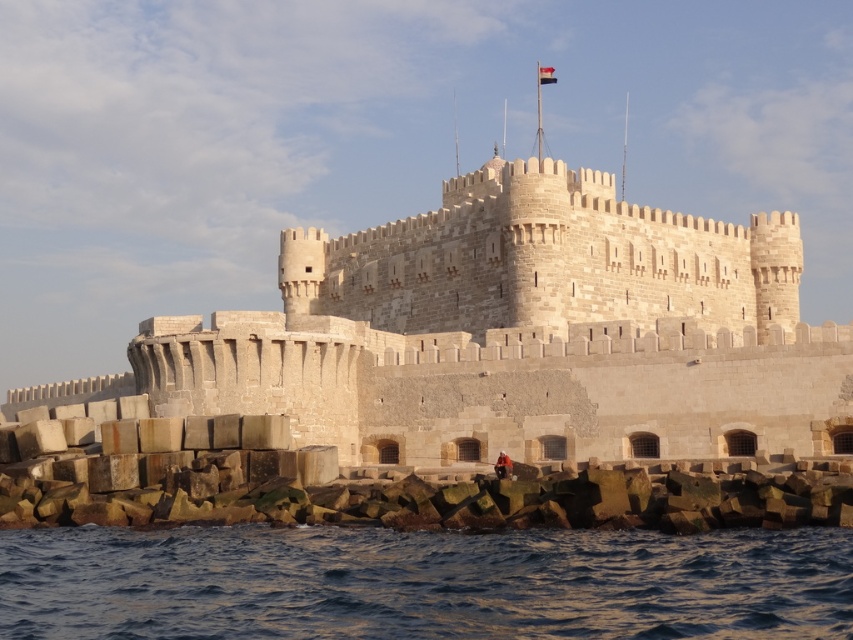
Question: Can you confirm if beige stone castle at center is positioned above blue water at lower left?

Choices:
 (A) no
 (B) yes

Answer: (B)

Question: Which of the following is the closest to the observer?

Choices:
 (A) (811, 378)
 (B) (354, 573)

Answer: (B)

Question: Can you confirm if beige stone castle at center is positioned to the left of blue water at lower left?

Choices:
 (A) yes
 (B) no

Answer: (A)

Question: Is beige stone castle at center positioned before blue water at lower left?

Choices:
 (A) no
 (B) yes

Answer: (A)

Question: Which point is farther to the camera?

Choices:
 (A) blue water at lower left
 (B) beige stone castle at center

Answer: (B)

Question: Which point is closer to the camera?

Choices:
 (A) (585, 556)
 (B) (283, 244)

Answer: (A)